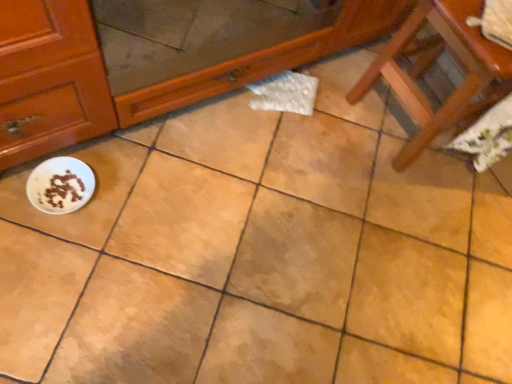
I want to click on free point to the left of wooden chair at lower right, so click(331, 105).